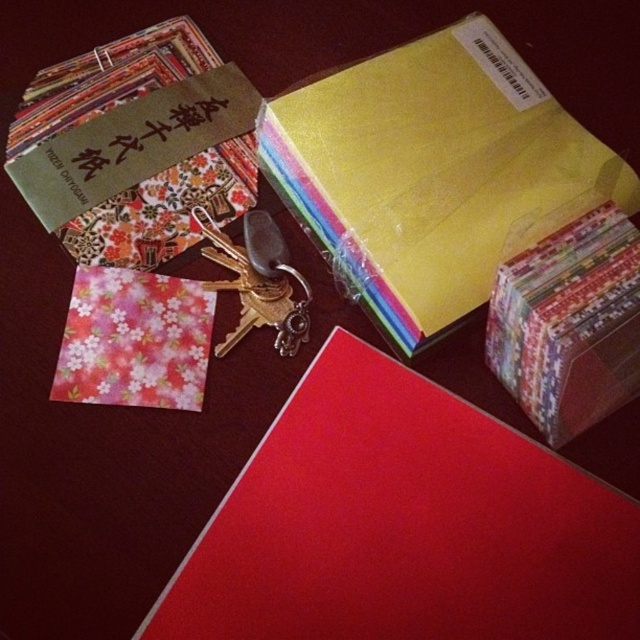
Question: Based on their relative distances, which object is nearer to the floral paper at lower left?

Choices:
 (A) floral paper gift box at upper right
 (B) yellow matte/envelope at upper center

Answer: (B)

Question: Is floral paper gift box at upper right further to camera compared to floral paper at lower left?

Choices:
 (A) yes
 (B) no

Answer: (B)

Question: Which point is farther to the camera?

Choices:
 (A) [x=204, y=253]
 (B) [x=621, y=284]
 (C) [x=346, y=192]
 (D) [x=115, y=403]

Answer: (A)

Question: Which object is closer to the camera taking this photo?

Choices:
 (A) yellow matte/envelope at upper center
 (B) floral paper gift box at upper right
 (C) metallic gold key at center

Answer: (B)

Question: Can you confirm if yellow matte/envelope at upper center is positioned to the right of floral paper gift box at upper right?

Choices:
 (A) yes
 (B) no

Answer: (B)

Question: Can you confirm if floral paper gift box at upper right is positioned to the left of floral paper at lower left?

Choices:
 (A) no
 (B) yes

Answer: (A)